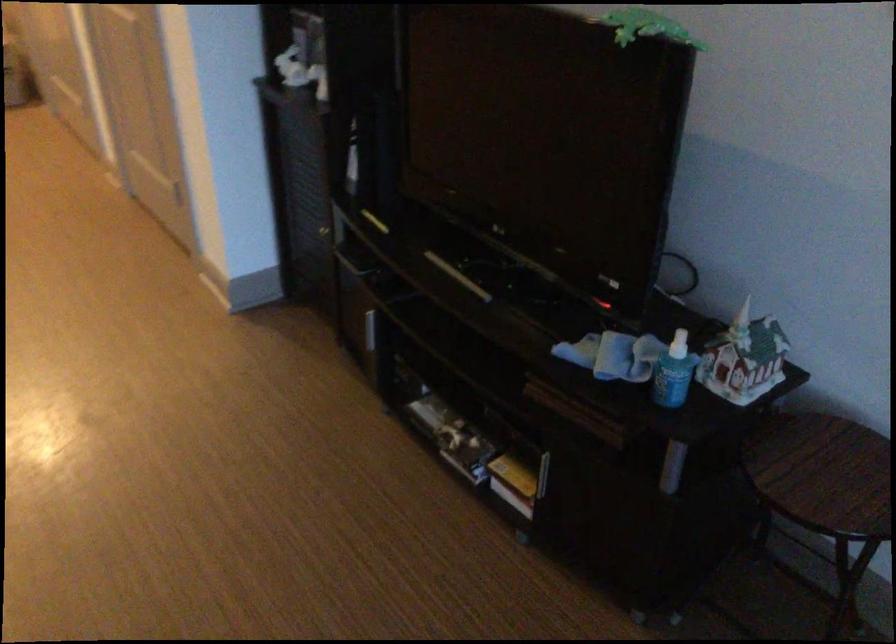
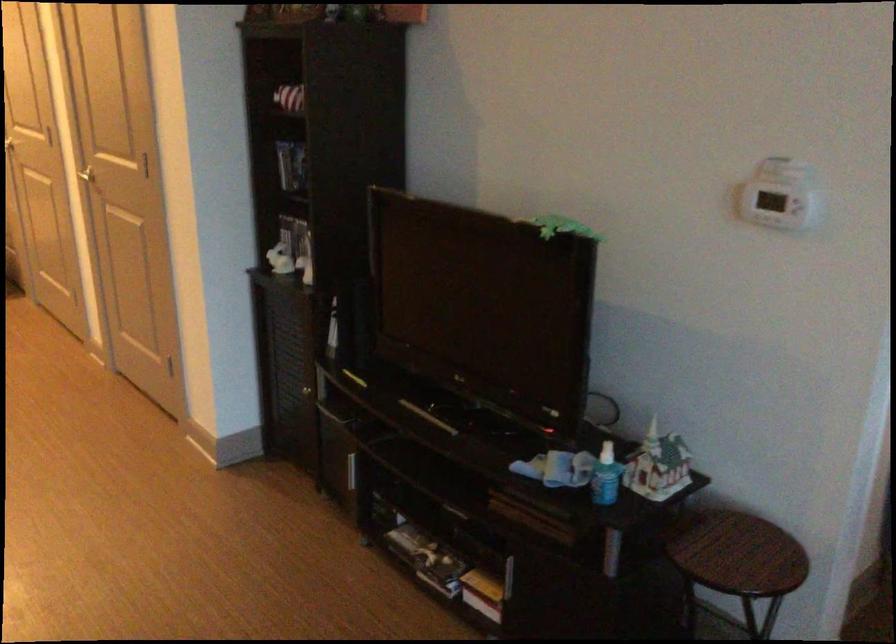
In the second image, find the point that corresponds to point 309,223 in the first image.

(291, 383)